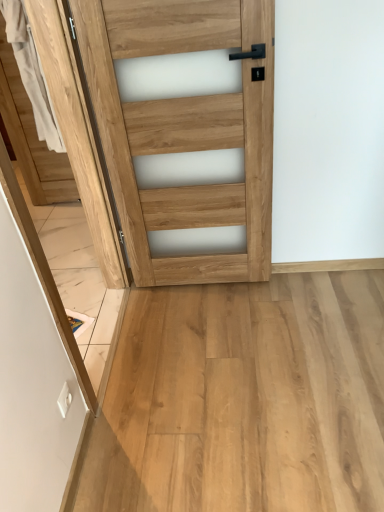
This screenshot has height=512, width=384. What do you see at coordinates (185, 128) in the screenshot?
I see `natural wood door at center` at bounding box center [185, 128].

Identify the location of natural wood door at center. (185, 128).

Describe the element at coordinates (32, 385) in the screenshot. The width and height of the screenshot is (384, 512). I see `natural wood screen door at left` at that location.

Find the location of a particular element. natural wood screen door at left is located at coordinates (32, 385).

In order to click on natural wood door at center in this screenshot , I will do (185, 128).

Which object is positioned more to the left, natural wood screen door at left or natural wood door at center?

From the viewer's perspective, natural wood screen door at left appears more on the left side.

In the image, is natural wood screen door at left positioned in front of or behind natural wood door at center?

In the image, natural wood screen door at left appears behind natural wood door at center.

Which point is more distant from viewer, (50,453) or (244,193)?

The point (244,193) is more distant.

From the image's perspective, is natural wood screen door at left on natural wood door at center?

Actually, natural wood screen door at left appears below natural wood door at center in the image.

From a real-world perspective, which object stands above the other?

In real-world perspective, natural wood door at center is above.

Which of these two, natural wood screen door at left or natural wood door at center, is thinner?

With smaller width is natural wood door at center.

Can you confirm if natural wood screen door at left is taller than natural wood door at center?

No, natural wood screen door at left is not taller than natural wood door at center.

Does natural wood screen door at left have a larger size compared to natural wood door at center?

Incorrect, natural wood screen door at left is not larger than natural wood door at center.

Which is correct: natural wood screen door at left is inside natural wood door at center, or outside of it?

natural wood screen door at left exists outside the volume of natural wood door at center.

Is natural wood screen door at left next to natural wood door at center and touching it?

No.

Does natural wood screen door at left turn towards natural wood door at center?

No.

How different are the orientations of natural wood screen door at left and natural wood door at center in degrees?

The angular difference between natural wood screen door at left and natural wood door at center is 88.3 degrees.

This screenshot has width=384, height=512. Identify the location of screen door below the natural wood door at center (from the image's perspective). (32, 385).

Which object is positioned more to the right, natural wood door at center or natural wood screen door at left?

natural wood door at center.

Considering the positions of objects natural wood door at center and natural wood screen door at left in the image provided, who is in front, natural wood door at center or natural wood screen door at left?

natural wood door at center is closer to the camera.

Is point (237, 189) closer to camera compared to point (54, 428)?

No, it is behind (54, 428).

From the image's perspective, is natural wood door at center located beneath natural wood screen door at left?

No.

From a real-world perspective, is natural wood door at center on top of natural wood screen door at left?

Yes.

In terms of width, does natural wood door at center look wider or thinner when compared to natural wood screen door at left?

Considering their sizes, natural wood door at center looks slimmer than natural wood screen door at left.

Does natural wood door at center have a greater height compared to natural wood screen door at left?

Correct, natural wood door at center is much taller as natural wood screen door at left.

Does natural wood door at center have a smaller size compared to natural wood screen door at left?

No, natural wood door at center is not smaller than natural wood screen door at left.

Would you say natural wood screen door at left is part of natural wood door at center's contents?

No, natural wood screen door at left is located outside of natural wood door at center.

Is natural wood door at center far away from natural wood screen door at left?

No.

Does natural wood door at center turn towards natural wood screen door at left?

No, natural wood door at center is not facing towards natural wood screen door at left.

The width and height of the screenshot is (384, 512). Find the location of `door above the natural wood screen door at left (from the image's perspective)`. door above the natural wood screen door at left (from the image's perspective) is located at coordinates (185, 128).

Find the location of `screen door below the natural wood door at center (from the image's perspective)`. screen door below the natural wood door at center (from the image's perspective) is located at coordinates (32, 385).

What are the coordinates of `door located in front of the natural wood screen door at left` in the screenshot? It's located at (185, 128).